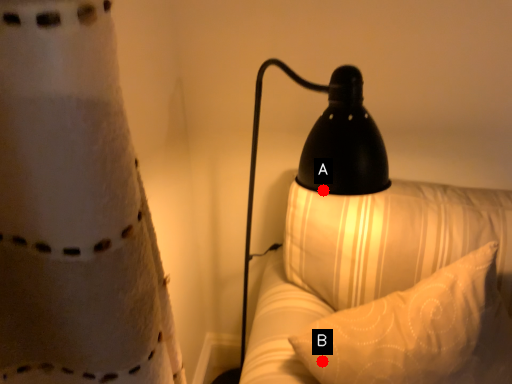
Question: Two points are circled on the image, labeled by A and B beside each circle. Which point is closer to the camera taking this photo?

Choices:
 (A) A is closer
 (B) B is closer

Answer: (A)